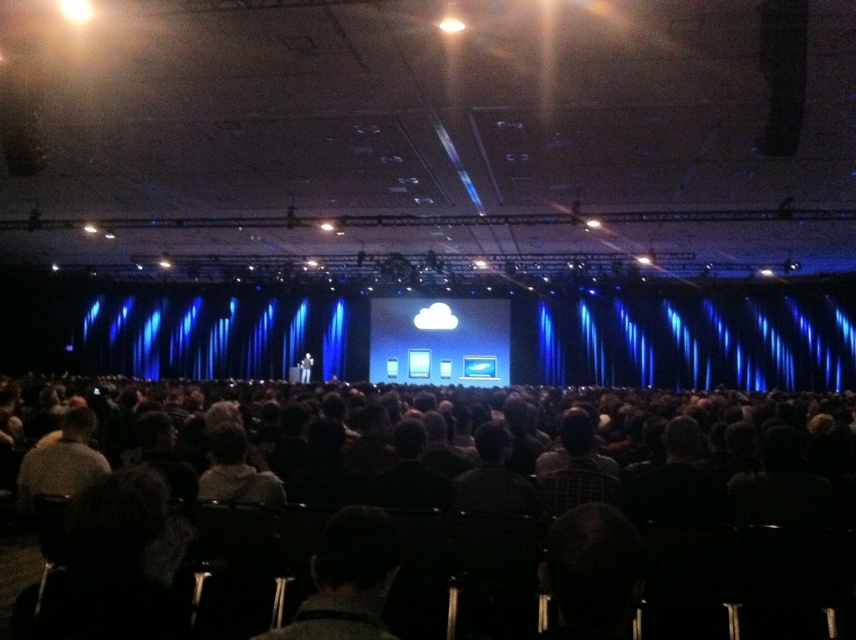
You are an event planner standing at the back of the audience area. You need to quickly assess if the two presenters wearing the dark woolen sweater at center and dark suit at center are positioned within a 70 feet safety zone for the event. Can you confirm this?

The dark woolen sweater at center is 71.63 feet away from the dark suit at center, which exceeds the 70 feet safety zone requirement. Therefore, they are not both within the same 70 feet safety zone.

You are an event organizer standing at the back of the hall. You need to quickly retrieve the dark woolen sweater at center before the next speaker arrives. The dark gray chairs at center are blocking your path. Can you walk around them without moving the chairs?

The dark gray chairs at center is 4.76 meters away from dark woolen sweater at center. Since the distance between them is sufficient, you can easily walk around the chairs to reach the dark woolen sweater at center without needing to move them.

You are an event organizer checking the stage setup. You notice the dark gray chairs at center and the dark suit at center. Which object is taller when viewed from the audience perspective?

The dark gray chairs at center is taller than the dark suit at center, so the dark gray chairs at center would be visible above the dark suit at center from the audience perspective.